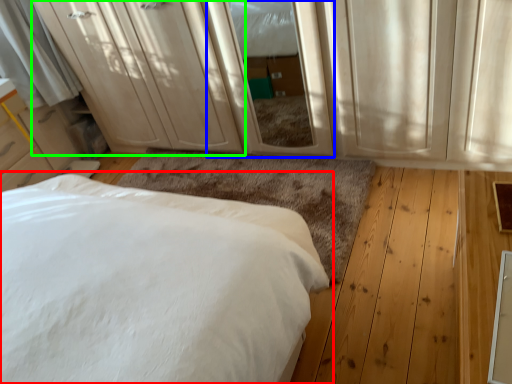
Question: Which object is the closest to the bed (highlighted by a red box)? Choose among these: screen door (highlighted by a blue box) or dresser (highlighted by a green box).

Choices:
 (A) screen door
 (B) dresser

Answer: (A)